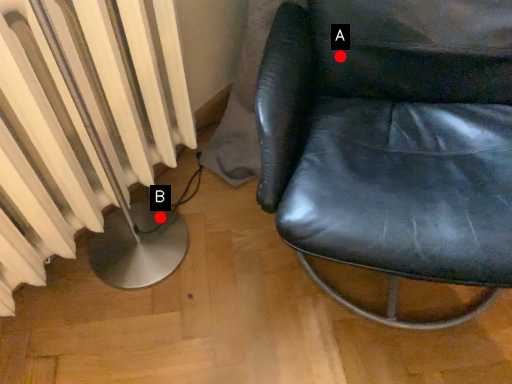
Question: Two points are circled on the image, labeled by A and B beside each circle. Which point is closer to the camera?

Choices:
 (A) A is closer
 (B) B is closer

Answer: (A)